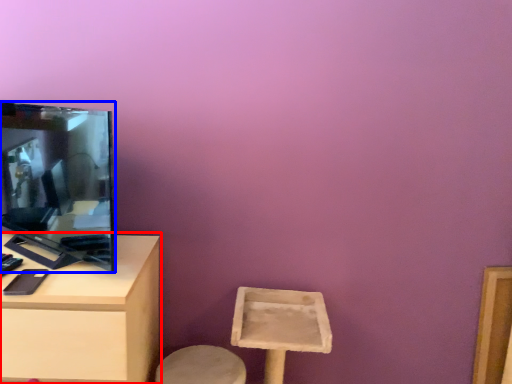
Question: Which object appears closest to the camera in this image, table (highlighted by a red box) or television (highlighted by a blue box)?

Choices:
 (A) table
 (B) television

Answer: (B)